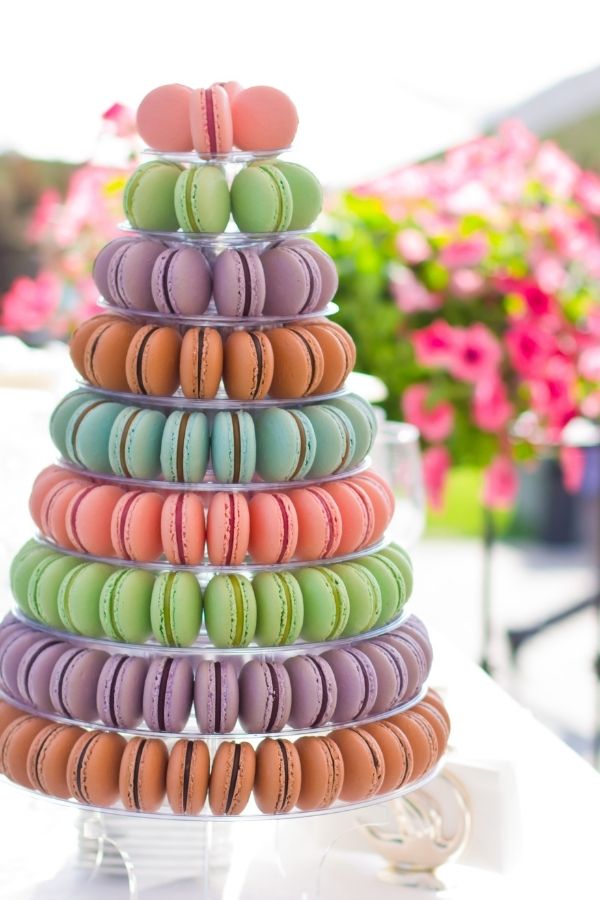
Locate an element on the screen. napkins is located at coordinates (483, 804).